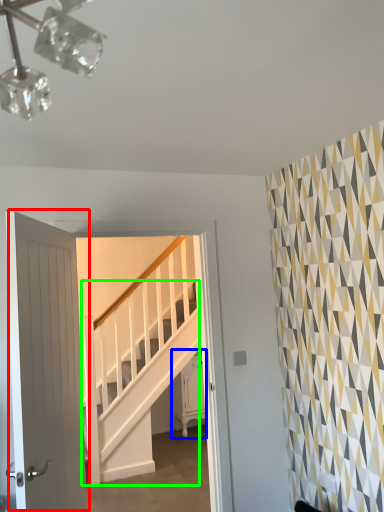
Question: Which is farther away from door (highlighted by a red box)? furniture (highlighted by a blue box) or stairs (highlighted by a green box)?

Choices:
 (A) furniture
 (B) stairs

Answer: (A)